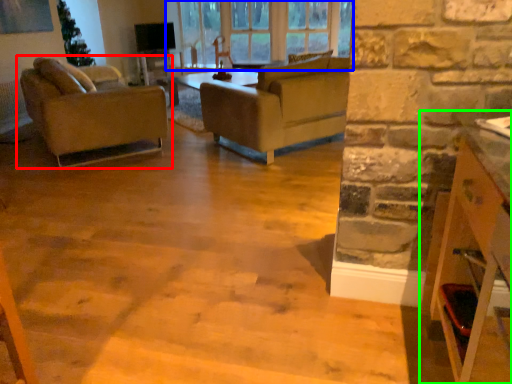
Question: Which object is the farthest from chair (highlighted by a red box)? Choose among these: window (highlighted by a blue box) or cabinetry (highlighted by a green box).

Choices:
 (A) window
 (B) cabinetry

Answer: (B)